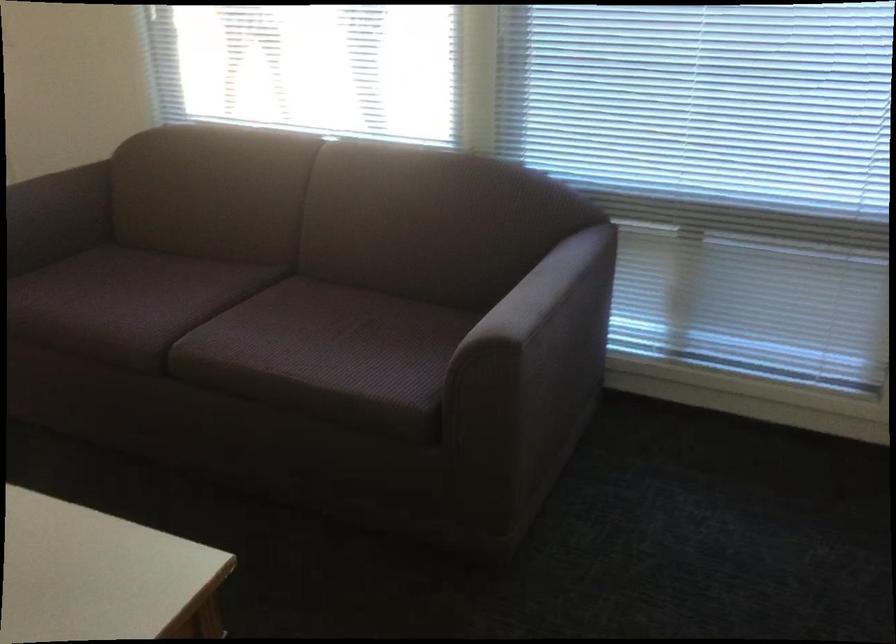
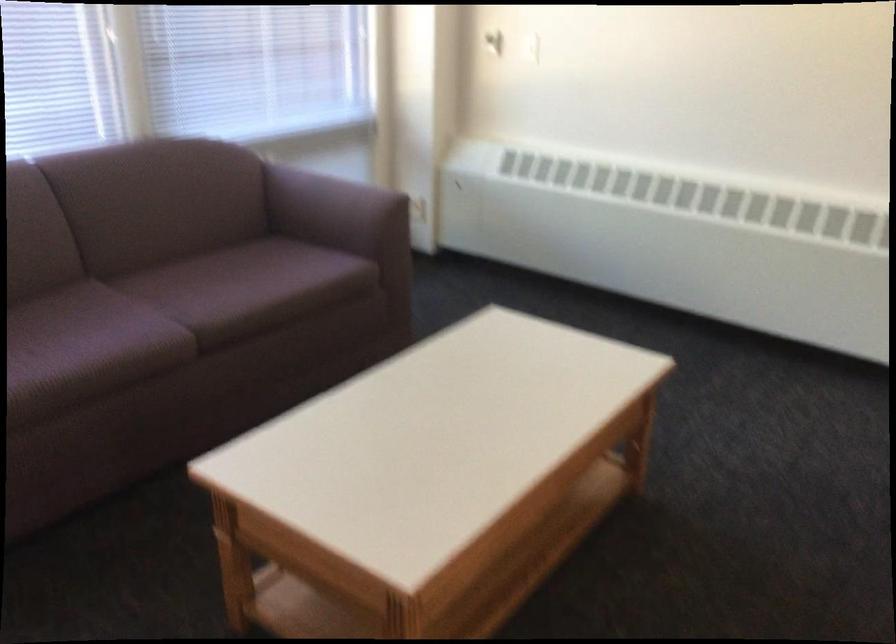
In the second image, find the point that corresponds to [216,330] in the first image.

(168, 316)